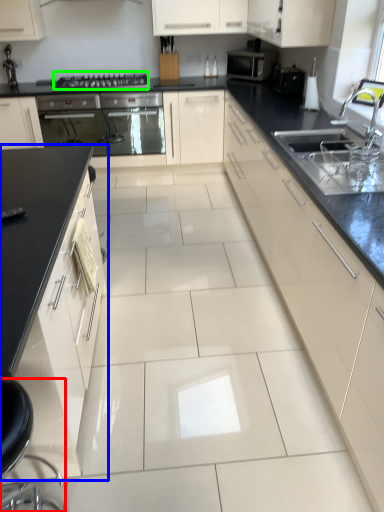
Question: Considering the real-world distances, which object is farthest from swivel chair (highlighted by a red box)? cabinetry (highlighted by a blue box) or gas stove (highlighted by a green box)?

Choices:
 (A) cabinetry
 (B) gas stove

Answer: (B)